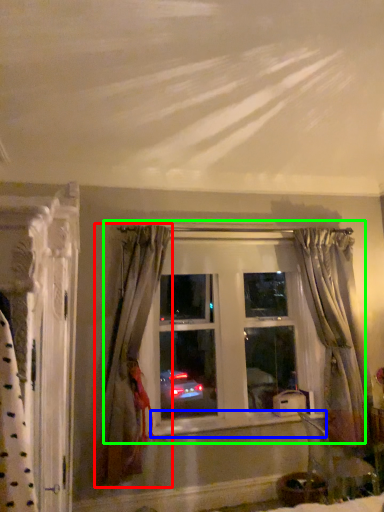
Question: Which object is positioned farthest from curtain (highlighted by a red box)? Select from window sill (highlighted by a blue box) and window (highlighted by a green box).

Choices:
 (A) window sill
 (B) window

Answer: (A)